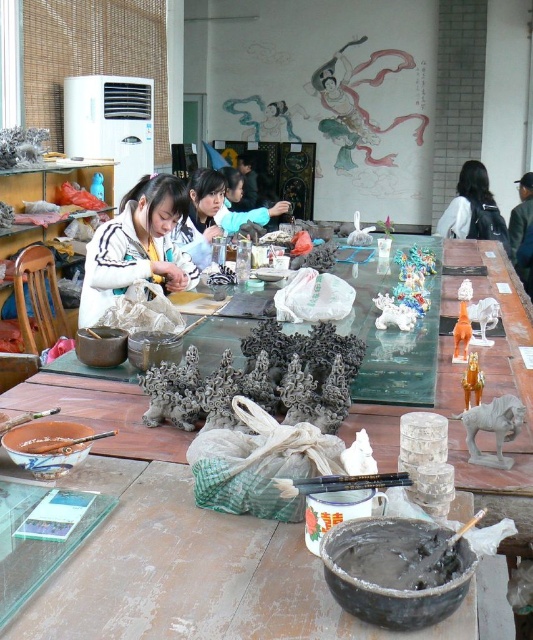
You are an artist working in the workshop. You need to retrieve the smooth gray paste at lower center but first must move the white matte jacket at center. Which object should you move first to access the other?

The white matte jacket at center is positioned on the left side of the smooth gray paste at lower center, so you should move the white matte jacket at center first to access the smooth gray paste at lower center.

Based on the photo, you are an artist working in the workshop and need to access both the white matte jacket at center and the black fabric bag at right. Which object is closer to you as you stand at the front of the table?

The white matte jacket at center is closer to you since it is in front of the black fabric bag at right.